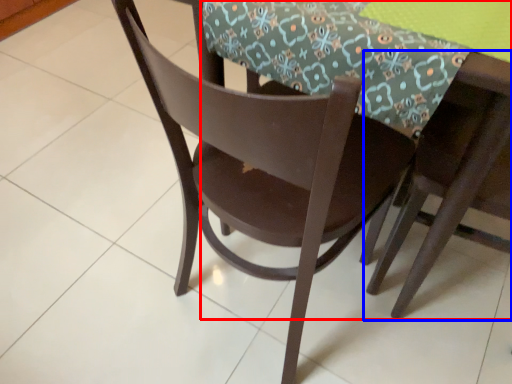
Question: Which of the following is the farthest to the observer, round table (highlighted by a red box) or chair (highlighted by a blue box)?

Choices:
 (A) round table
 (B) chair

Answer: (A)